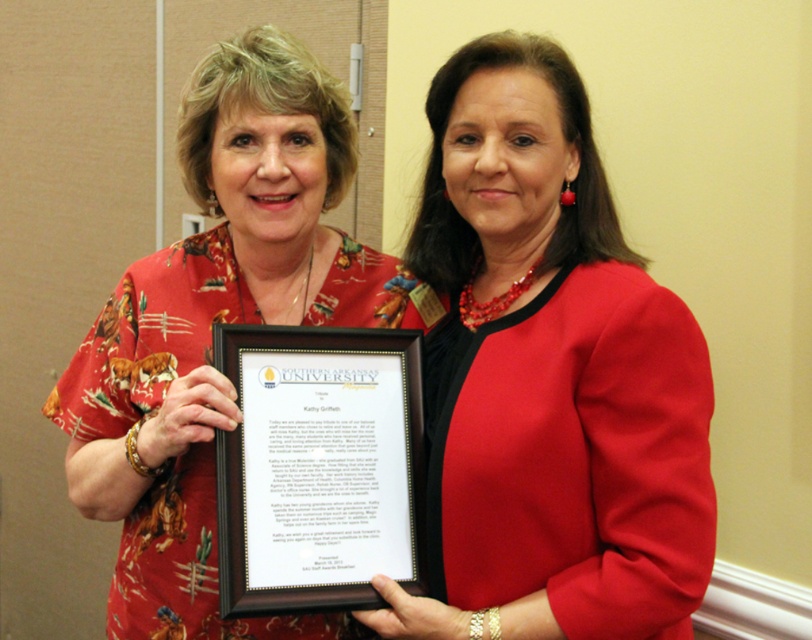
Is point (476, 632) in front of point (366, 580)?

Yes, point (476, 632) is in front of point (366, 580).

Is matte red blazer at center further to the viewer compared to black wood framed certificate at center?

No, matte red blazer at center is closer to the viewer.

Which is in front, point (461, 616) or point (415, 362)?

Point (461, 616)

Identify the location of matte red blazer at center. Image resolution: width=812 pixels, height=640 pixels. (547, 376).

Which is below, floral fabric blouse at center or black wood framed certificate at center?

Positioned lower is black wood framed certificate at center.

This screenshot has width=812, height=640. Find the location of `floral fabric blouse at center`. floral fabric blouse at center is located at coordinates (210, 328).

Locate an element on the screen. This screenshot has width=812, height=640. floral fabric blouse at center is located at coordinates (210, 328).

At what (x,y) coordinates should I click in order to perform the action: click on matte red blazer at center. Please return your answer as a coordinate pair (x, y). This screenshot has width=812, height=640. Looking at the image, I should click on (547, 376).

This screenshot has height=640, width=812. Describe the element at coordinates (547, 376) in the screenshot. I see `matte red blazer at center` at that location.

Is point (568, 422) positioned behind point (76, 362)?

No.

Identify the location of matte red blazer at center. (547, 376).